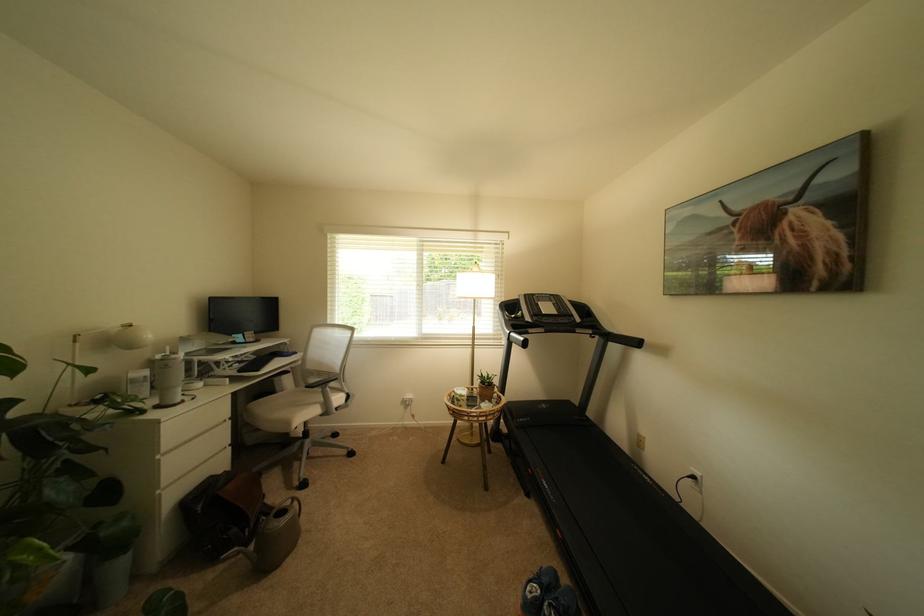
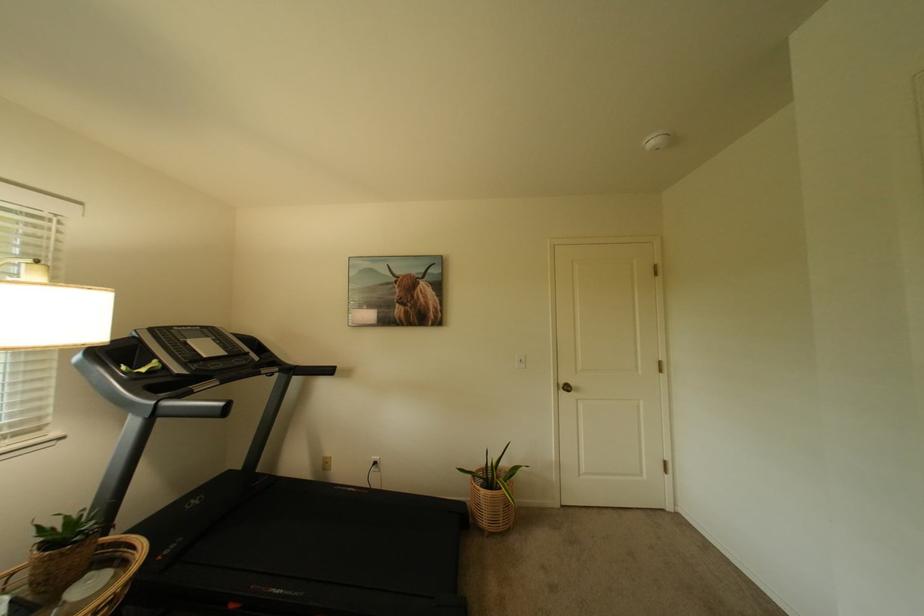
Locate, in the second image, the point that corresponds to (x=618, y=334) in the first image.

(305, 368)